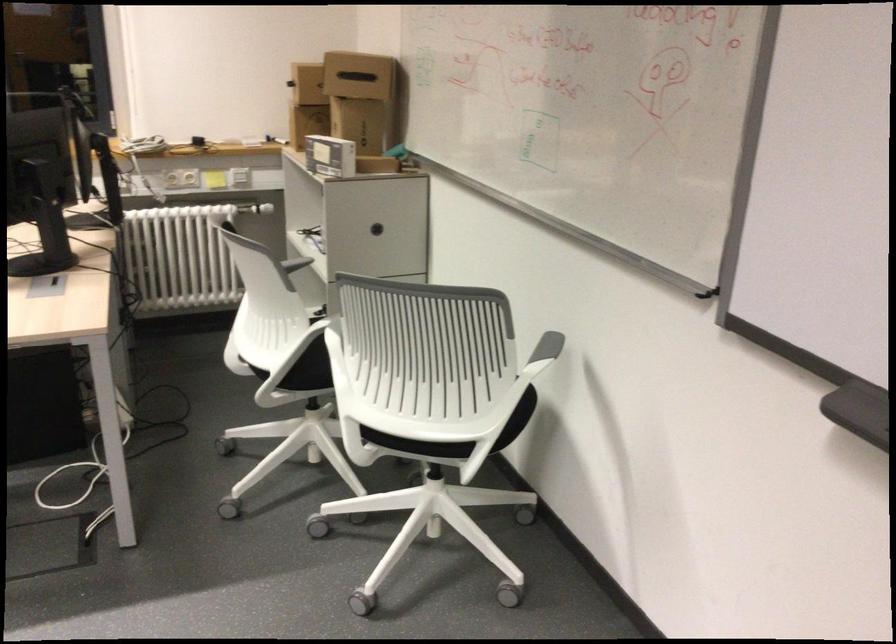
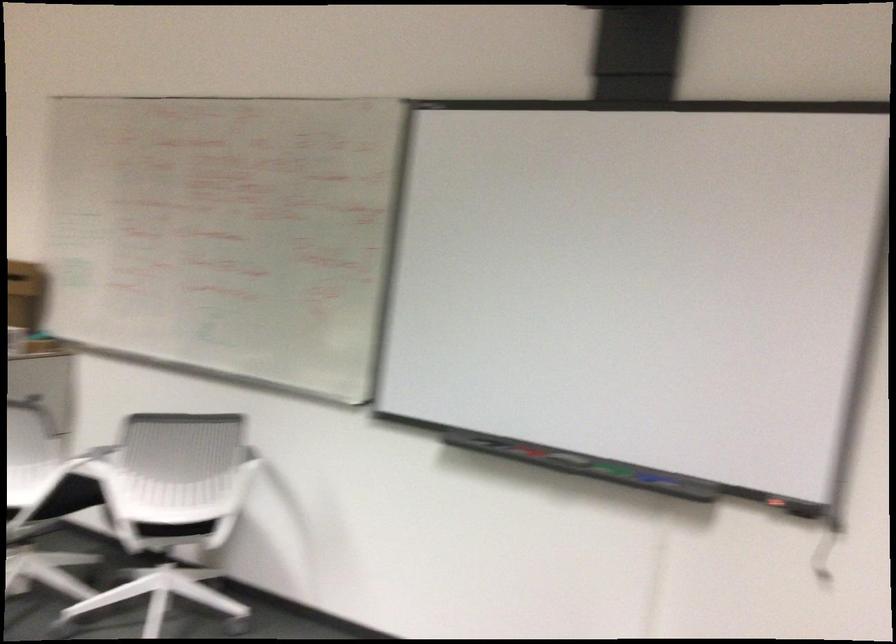
Where in the second image is the point corresponding to (355,319) from the first image?

(95, 460)